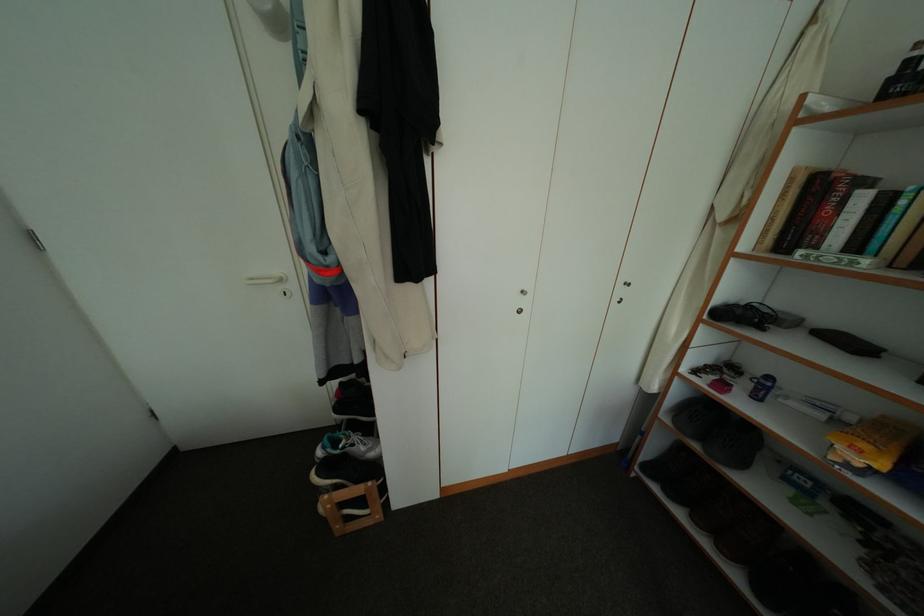
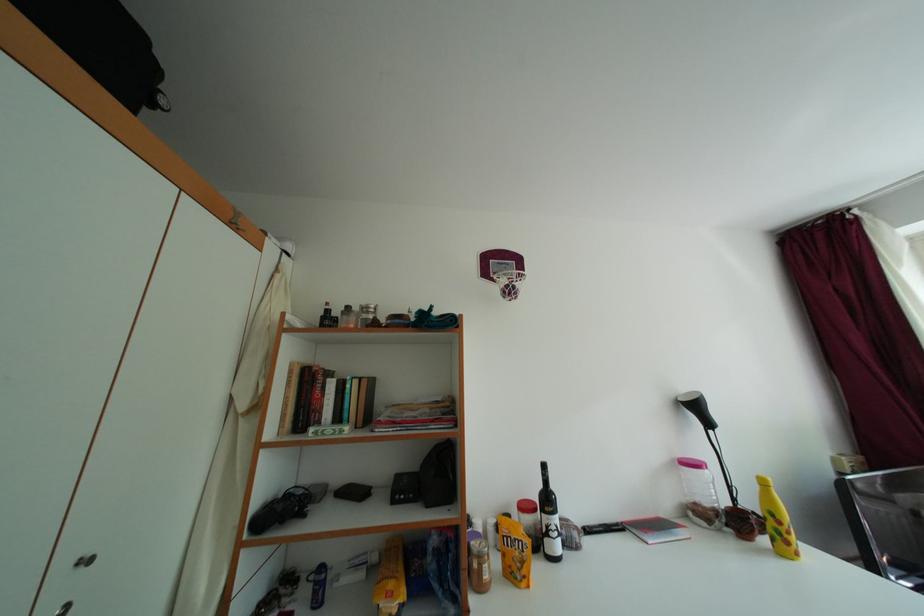
How did the camera likely rotate?

The camera's rotation is toward right-up.